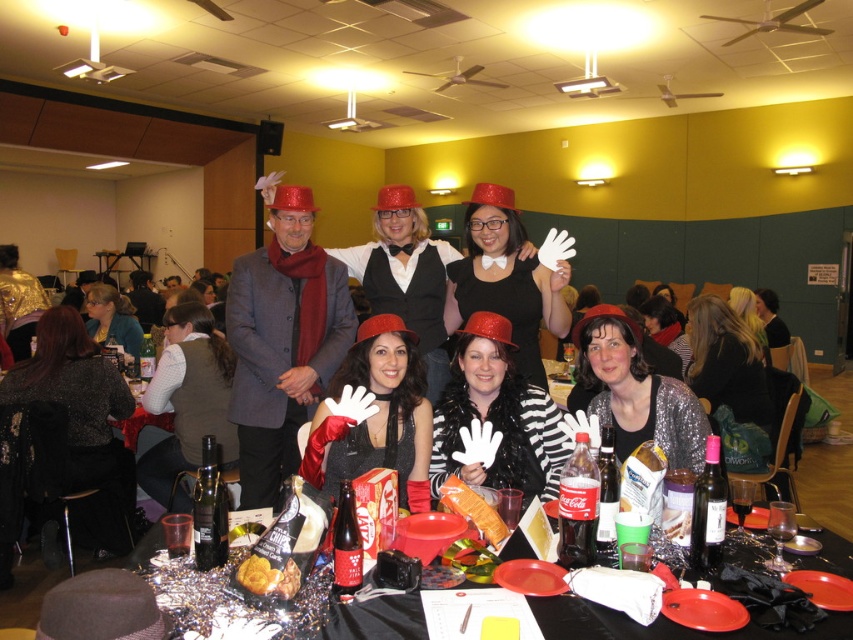
Question: Which is nearer to the black plastic table at center?

Choices:
 (A) white matte gloves at center
 (B) golden crispy pastry at center

Answer: (B)

Question: Can you confirm if sparkly silver dress at center is positioned to the right of golden crispy pastry at center?

Choices:
 (A) yes
 (B) no

Answer: (A)

Question: Does matte black dress at center have a lesser width compared to white matte gloves at center?

Choices:
 (A) yes
 (B) no

Answer: (A)

Question: Among these points, which one is nearest to the camera?

Choices:
 (A) (410, 394)
 (B) (157, 588)
 (C) (508, 275)

Answer: (B)

Question: Does matte red hat at center have a larger size compared to sparkly silver dress at center?

Choices:
 (A) no
 (B) yes

Answer: (B)

Question: Which point is farther to the camera?

Choices:
 (A) sparkly black dress at lower left
 (B) velvet brown vest at lower left

Answer: (B)